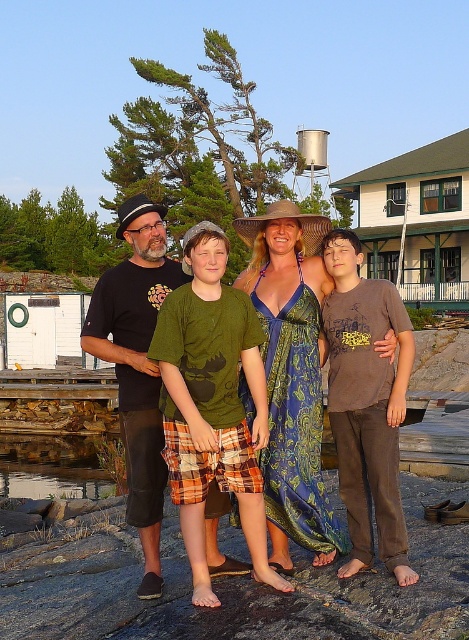
Is point (195, 497) farther from camera compared to point (333, 292)?

No, (195, 497) is closer to viewer.

Is green cotton shirt at center further to the viewer compared to brown cotton shirt at right?

No, it is not.

Measure the distance between green cotton shirt at center and camera.

4.33 meters

Locate an element on the screen. green cotton shirt at center is located at coordinates (217, 381).

Between brown cotton shirt at right and black cotton t-shirt at left, which one has more height?

With more height is black cotton t-shirt at left.

Can you confirm if brown cotton shirt at right is positioned below black cotton t-shirt at left?

Yes.

Who is more distant from viewer, (394, 444) or (96, 300)?

The point (96, 300) is behind.

Locate an element on the screen. The width and height of the screenshot is (469, 640). brown cotton shirt at right is located at coordinates (367, 404).

Which of these two, green cotton t-shirt at center or brown cotton shirt at right, stands taller?

brown cotton shirt at right is taller.

Is green cotton t-shirt at center thinner than brown cotton shirt at right?

Correct, green cotton t-shirt at center's width is less than brown cotton shirt at right's.

Identify the location of green cotton t-shirt at center. Image resolution: width=469 pixels, height=640 pixels. tap(136, 364).

Identify the location of green cotton t-shirt at center. (136, 364).